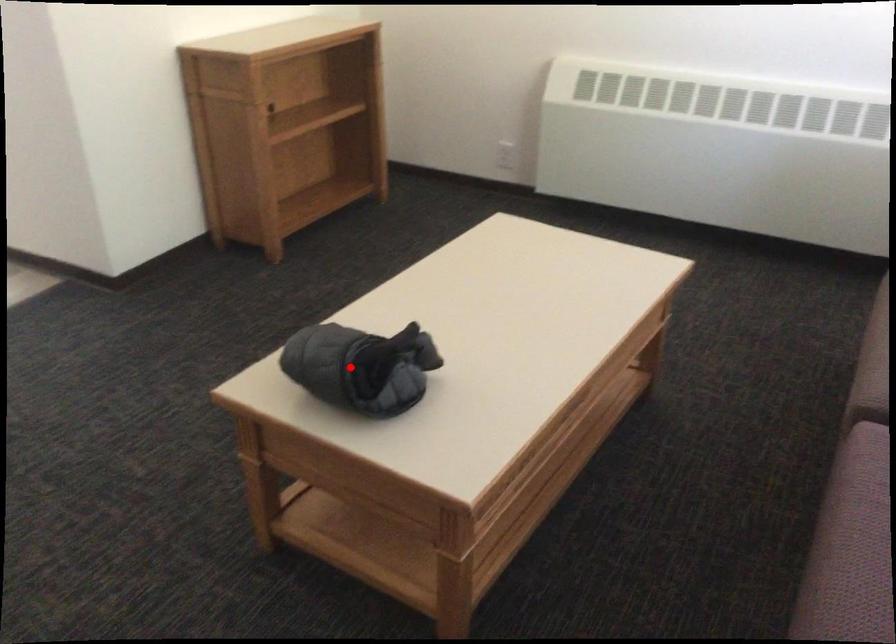
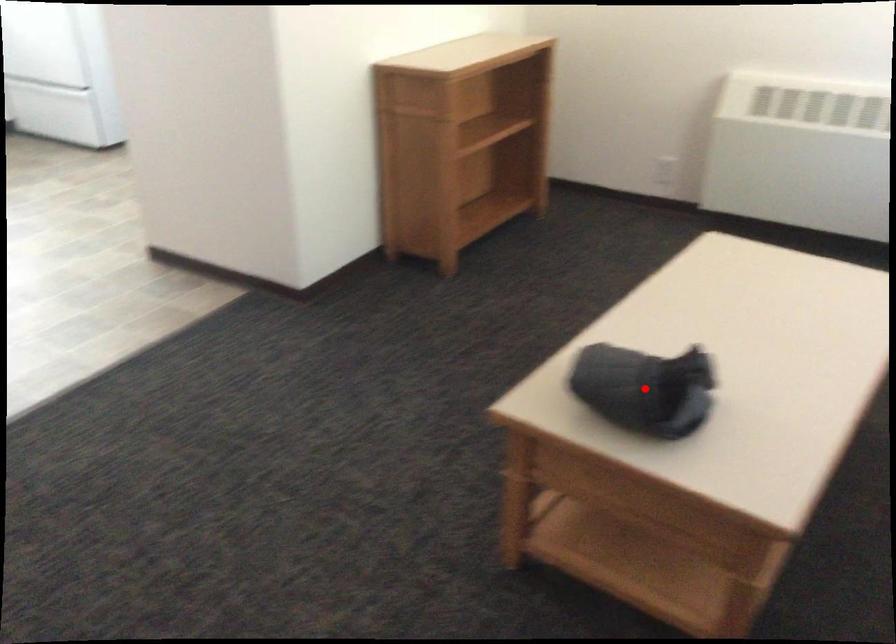
I am providing you with two images of the same scene from different viewpoints. A red point is marked on the first image and another point is marked on the second image. Are the points marked in image1 and image2 representing the same 3D position?

Yes